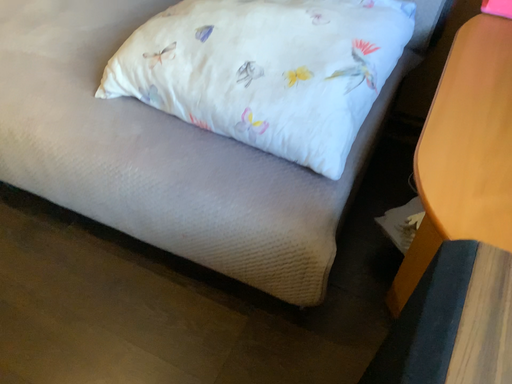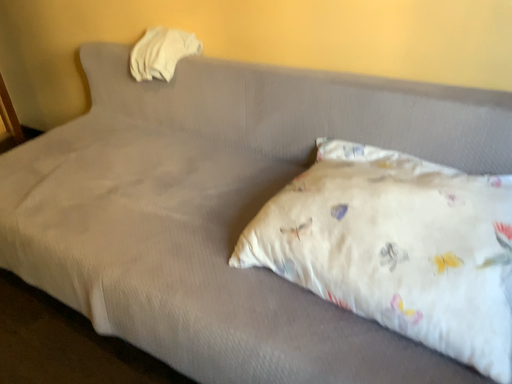
Question: Which way did the camera rotate in the video?

Choices:
 (A) rotated upward
 (B) rotated downward

Answer: (A)